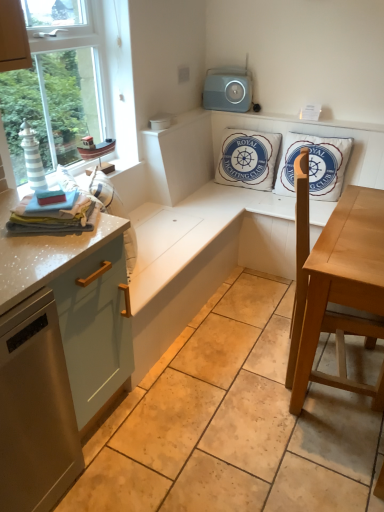
Question: Based on their sizes in the image, would you say satin silver dishwasher at lower left is bigger or smaller than white cotton cushion at upper center, which is the 1th pillow in left-to-right order?

Choices:
 (A) small
 (B) big

Answer: (B)

Question: In the image, is satin silver dishwasher at lower left on the left side or the right side of white cotton cushion at upper center, which is counted as the second pillow, starting from the right?

Choices:
 (A) left
 (B) right

Answer: (A)

Question: Based on their relative distances, which object is nearer to the white cotton cushion at upper right, marked as the 1th pillow in a right-to-left arrangement?

Choices:
 (A) satin silver dishwasher at lower left
 (B) gray plastic speaker at upper center
 (C) matte light blue cabinet at left
 (D) white cotton cushion at upper center, which is counted as the second pillow, starting from the right
 (E) light brown wooden table at center

Answer: (D)

Question: Which object is positioned farthest from the white cotton cushion at upper right, which is counted as the 2th pillow, starting from the left?

Choices:
 (A) gray plastic speaker at upper center
 (B) white cotton cushion at upper center, which is counted as the second pillow, starting from the right
 (C) satin silver dishwasher at lower left
 (D) matte light blue cabinet at left
 (E) light brown wooden table at center

Answer: (C)